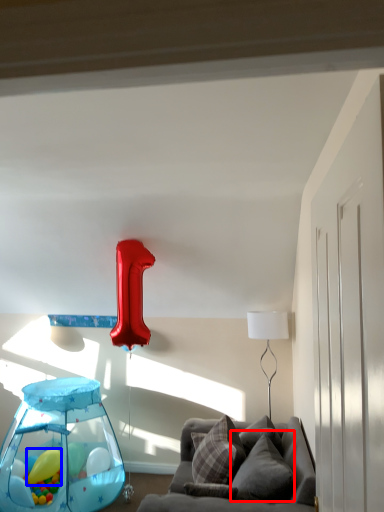
Question: Which point is further to the camera, pillow (highlighted by a red box) or balloon (highlighted by a blue box)?

Choices:
 (A) pillow
 (B) balloon

Answer: (B)